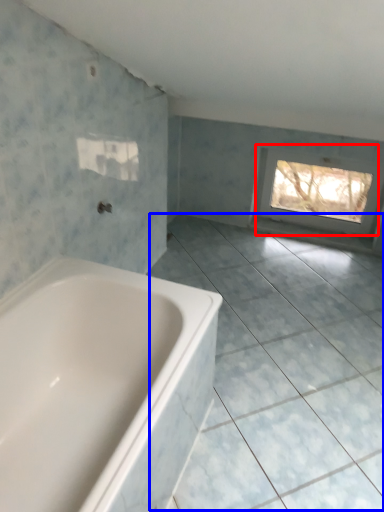
Question: Which object appears closest to the camera in this image, window (highlighted by a red box) or ceramic tile (highlighted by a blue box)?

Choices:
 (A) window
 (B) ceramic tile

Answer: (B)